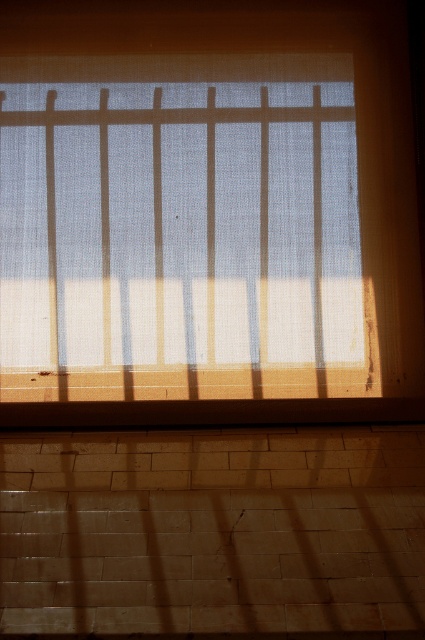
You are standing in a room with a window covered by a curtain. You see the white sheer fabric at center and the brown wood at bottom. Which object is closer to the ceiling?

The white sheer fabric at center is above the brown wood at bottom, so it is closer to the ceiling.

You are a painter standing in front of the window with the white sheer fabric at center and the brown wood at bottom. You want to paint the scene but need to know which object is taller. Can you tell me which one is taller?

The white sheer fabric at center is taller than brown wood at bottom.

You are standing in front of the window with the textured curtain and want to place a small decoration on the wall. You have two points marked on the wall where you can place it. The points are labeled as point (303, 339) and point (391, 420). Which point is closer to you so the decoration will be more visible?

Point (303, 339) is further to the viewer than point (391, 420). Therefore, placing the decoration at point (303, 339) will make it more visible since it is closer to you.